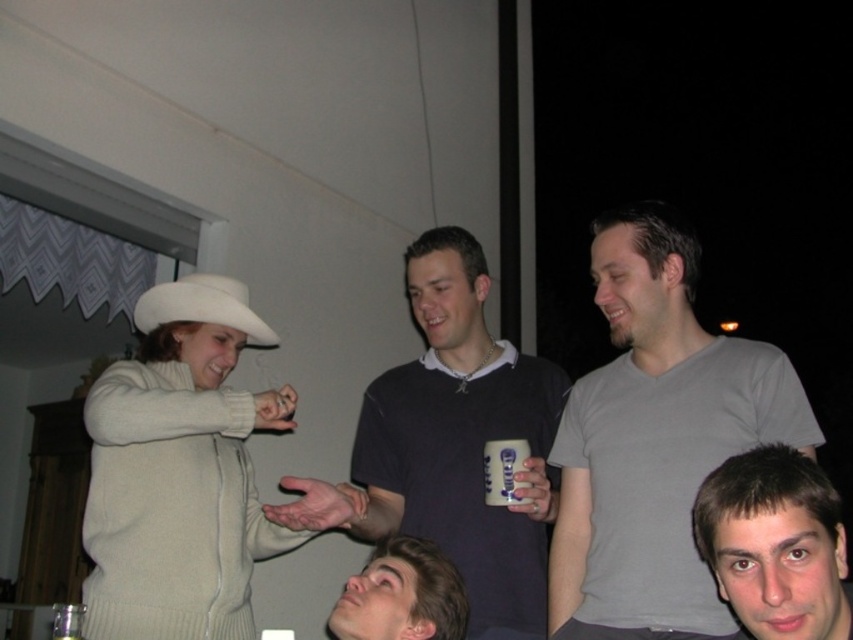
Which of these two, gray matte t-shirt at upper right or white felt cowboy hat at upper left, stands shorter?

Standing shorter between the two is white felt cowboy hat at upper left.

At what (x,y) coordinates should I click in order to perform the action: click on gray matte t-shirt at upper right. Please return your answer as a coordinate pair (x, y). Looking at the image, I should click on (654, 440).

The height and width of the screenshot is (640, 853). I want to click on gray matte t-shirt at upper right, so click(x=654, y=440).

Can you confirm if smooth skin face at lower right is bigger than white felt cowboy hat at upper left?

No, smooth skin face at lower right is not bigger than white felt cowboy hat at upper left.

Between smooth skin face at lower right and white felt cowboy hat at upper left, which one has less height?

With less height is white felt cowboy hat at upper left.

Measure the distance between point (x=772, y=566) and camera.

1.20 meters

Find the location of a particular element. The width and height of the screenshot is (853, 640). smooth skin face at lower right is located at coordinates (775, 544).

Measure the distance from gray matte t-shirt at upper right to dark gray sweater at center.

12.62 inches

Is gray matte t-shirt at upper right closer to the viewer compared to dark gray sweater at center?

That is True.

Where is `gray matte t-shirt at upper right`? The height and width of the screenshot is (640, 853). gray matte t-shirt at upper right is located at coordinates (654, 440).